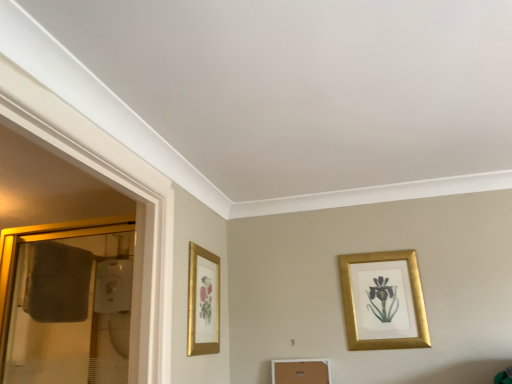
Question: Are gold-framed mirror at left and gold framed picture at left, the first picture frame viewed from the left, located far from each other?

Choices:
 (A) no
 (B) yes

Answer: (A)

Question: From a real-world perspective, is gold-framed mirror at left on top of gold framed picture at left, the first picture frame viewed from the left?

Choices:
 (A) no
 (B) yes

Answer: (B)

Question: Can you confirm if gold-framed mirror at left is wider than gold framed picture at left, the second picture frame when ordered from right to left?

Choices:
 (A) no
 (B) yes

Answer: (B)

Question: Is gold-framed mirror at left to the right of gold framed picture at left, the first picture frame viewed from the left, from the viewer's perspective?

Choices:
 (A) no
 (B) yes

Answer: (A)

Question: Considering the relative sizes of gold-framed mirror at left and gold framed picture at left, the first picture frame viewed from the left, in the image provided, is gold-framed mirror at left bigger than gold framed picture at left, the first picture frame viewed from the left,?

Choices:
 (A) yes
 (B) no

Answer: (A)

Question: Is gold-framed mirror at left located outside gold framed picture at left, the first picture frame viewed from the left?

Choices:
 (A) no
 (B) yes

Answer: (B)

Question: Is gold metallic picture frame at upper right, which appears as the 2th picture frame when viewed from the left, beside gold framed picture at left, the second picture frame when ordered from right to left?

Choices:
 (A) yes
 (B) no

Answer: (B)

Question: From a real-world perspective, is gold metallic picture frame at upper right, which appears as the 2th picture frame when viewed from the left, located higher than gold framed picture at left, the first picture frame viewed from the left?

Choices:
 (A) yes
 (B) no

Answer: (B)

Question: From a real-world perspective, is gold metallic picture frame at upper right, which appears as the 2th picture frame when viewed from the left, physically below gold framed picture at left, the second picture frame when ordered from right to left?

Choices:
 (A) yes
 (B) no

Answer: (A)

Question: Is the position of gold metallic picture frame at upper right, which appears as the 2th picture frame when viewed from the left, less distant than that of gold framed picture at left, the second picture frame when ordered from right to left?

Choices:
 (A) no
 (B) yes

Answer: (A)

Question: Is gold metallic picture frame at upper right, which appears as the 2th picture frame when viewed from the left, aimed at gold framed picture at left, the second picture frame when ordered from right to left?

Choices:
 (A) no
 (B) yes

Answer: (A)

Question: Considering the relative sizes of gold metallic picture frame at upper right, placed as the 1th picture frame when sorted from right to left, and gold framed picture at left, the second picture frame when ordered from right to left, in the image provided, is gold metallic picture frame at upper right, placed as the 1th picture frame when sorted from right to left, bigger than gold framed picture at left, the second picture frame when ordered from right to left,?

Choices:
 (A) yes
 (B) no

Answer: (A)

Question: From a real-world perspective, is gold metallic picture frame at upper right, placed as the 1th picture frame when sorted from right to left, beneath gold-framed mirror at left?

Choices:
 (A) yes
 (B) no

Answer: (A)